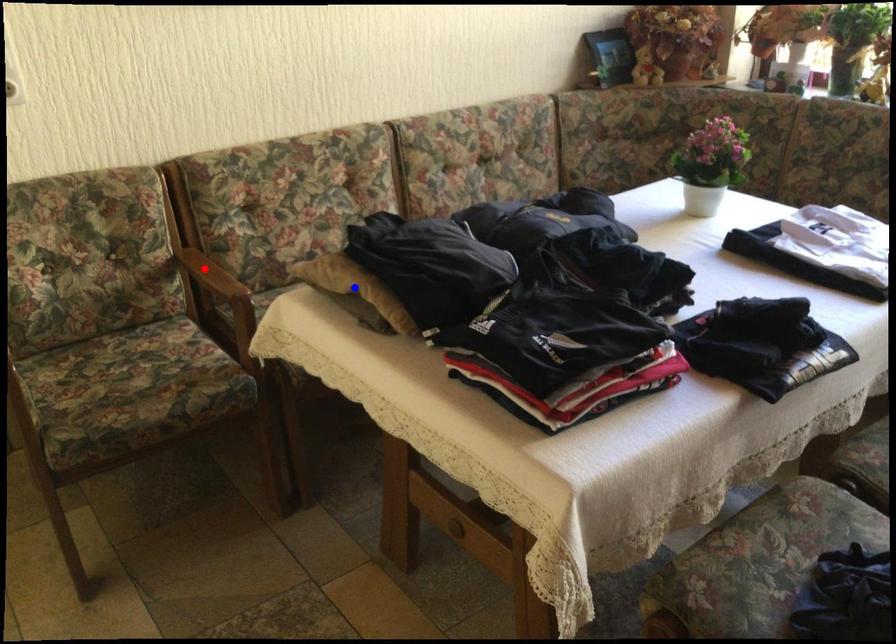
Question: Which of the two points in the image is closer to the camera?

Choices:
 (A) Blue point is closer.
 (B) Red point is closer.

Answer: (A)